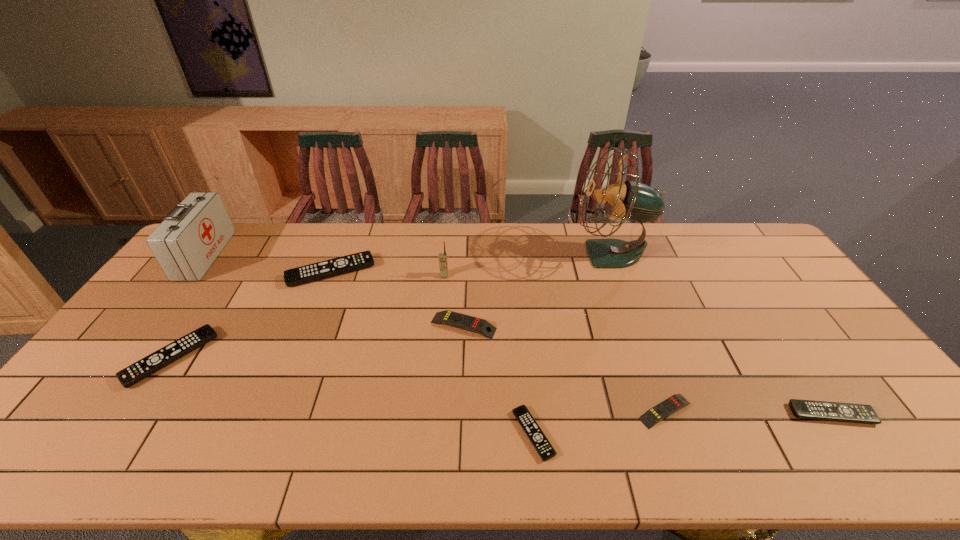
Locate an element on the screen. This screenshot has width=960, height=540. the leftmost remote control is located at coordinates (159, 359).

You are a GUI agent. You are given a task and a screenshot of the screen. Output one action in this format:
    pyautogui.click(x=<x>, y=<y>)
    Task: Click on the second remote control from right to left
    
    Given the screenshot: What is the action you would take?
    pyautogui.click(x=650, y=418)

I want to click on the smaller yellow remote control, so click(x=650, y=418).

Where is `the second smallest black remote control`? The width and height of the screenshot is (960, 540). the second smallest black remote control is located at coordinates click(806, 409).

Locate an element on the screen. The width and height of the screenshot is (960, 540). the rightmost remote control is located at coordinates (806, 409).

Image resolution: width=960 pixels, height=540 pixels. I want to click on the fourth object from right to left, so [x=540, y=442].

Locate an element on the screen. Image resolution: width=960 pixels, height=540 pixels. the shortest object is located at coordinates (540, 442).

You are a GUI agent. You are given a task and a screenshot of the screen. Output one action in this format:
    pyautogui.click(x=<x>, y=<y>)
    Task: Click on the vacant region located 0.390m on the front-facing side of the fan for air flow
    This screenshot has width=960, height=540.
    Given the screenshot: What is the action you would take?
    pyautogui.click(x=462, y=254)

Image resolution: width=960 pixels, height=540 pixels. What are the coordinates of `free space located on the front-facing side of the fan for air flow` in the screenshot? It's located at (473, 254).

This screenshot has width=960, height=540. I want to click on free point located on the front-facing side of the fan for air flow, so click(x=462, y=254).